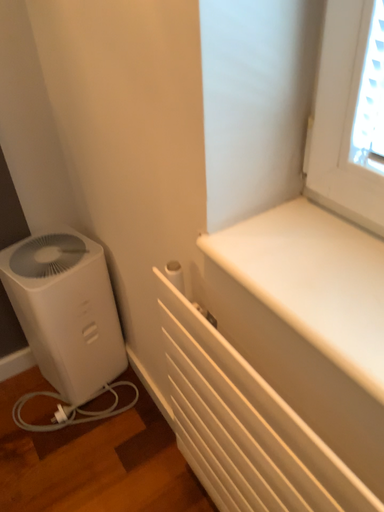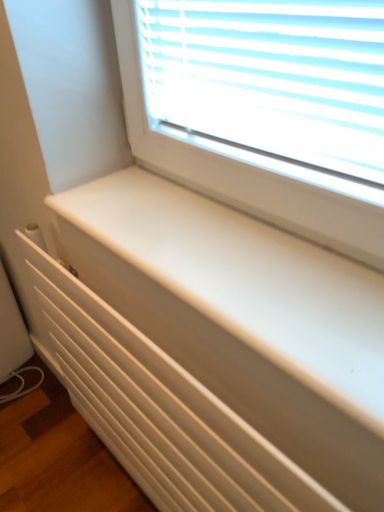
Question: How did the camera likely rotate when shooting the video?

Choices:
 (A) rotated left
 (B) rotated right

Answer: (B)